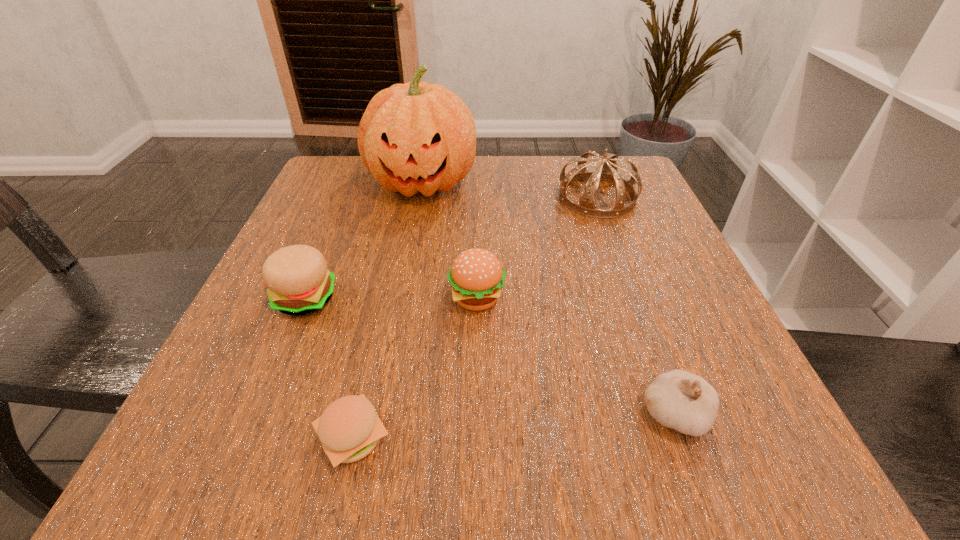
Image resolution: width=960 pixels, height=540 pixels. Find the location of `garlic that is positioned at the right edge`. garlic that is positioned at the right edge is located at coordinates (677, 399).

The width and height of the screenshot is (960, 540). Identify the location of object positioned at the far left corner. (415, 137).

At what (x,y) coordinates should I click in order to perform the action: click on object that is at the far right corner. Please return your answer as a coordinate pair (x, y). The image size is (960, 540). Looking at the image, I should click on (607, 171).

I want to click on object positioned at the near right corner, so click(x=677, y=399).

Where is `blank space at the far edge`? This screenshot has height=540, width=960. blank space at the far edge is located at coordinates [513, 178].

In the image, there is a desktop. Where is `vacant space at the near edge`? Image resolution: width=960 pixels, height=540 pixels. vacant space at the near edge is located at coordinates (376, 476).

In the image, there is a desktop. Identify the location of free space at the left edge. This screenshot has height=540, width=960. (250, 391).

The image size is (960, 540). What are the coordinates of `vacant region at the right edge` in the screenshot? It's located at (687, 319).

The image size is (960, 540). In order to click on free region at the far left corner of the desktop in this screenshot , I will do `click(340, 156)`.

Locate an element on the screen. This screenshot has height=540, width=960. blank space at the near left corner is located at coordinates (286, 462).